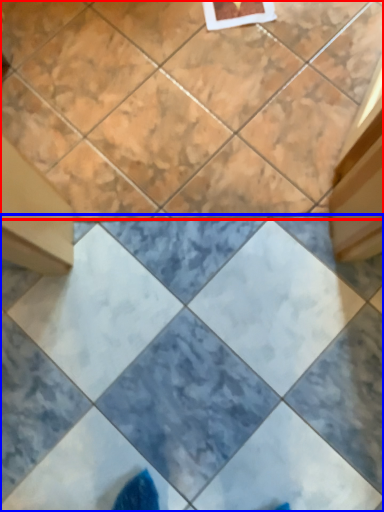
Question: Which object is closer to the camera taking this photo, ceramic tile (highlighted by a red box) or ceramic tile (highlighted by a blue box)?

Choices:
 (A) ceramic tile
 (B) ceramic tile

Answer: (B)